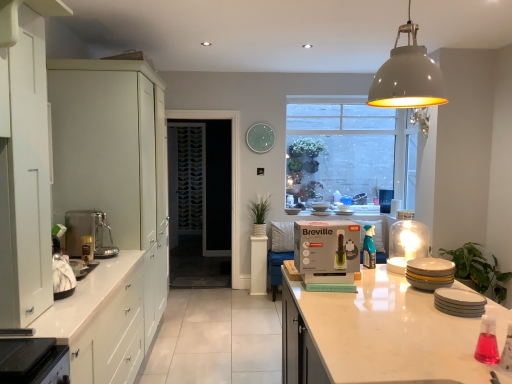
Question: From the image's perspective, would you say white glossy countertop at lower center, which is counted as the second countertop, starting from the front, is positioned over white matte cabinet at left, acting as the second cabinetry starting from the back?

Choices:
 (A) yes
 (B) no

Answer: (B)

Question: Could you tell me if white glossy countertop at lower center, which is counted as the second countertop, starting from the front, is turned towards white matte cabinet at left, acting as the second cabinetry starting from the back?

Choices:
 (A) yes
 (B) no

Answer: (B)

Question: Is white matte cabinet at left, acting as the second cabinetry starting from the back, located within white glossy countertop at lower center, which is counted as the second countertop, starting from the front?

Choices:
 (A) no
 (B) yes

Answer: (A)

Question: Does white glossy countertop at lower center, acting as the first countertop starting from the back, have a greater height compared to white matte cabinet at left, acting as the second cabinetry starting from the back?

Choices:
 (A) yes
 (B) no

Answer: (B)

Question: Can you confirm if white glossy countertop at lower center, positioned as the 1th countertop in right-to-left order, is positioned to the right of white matte cabinet at left, placed as the 1th cabinetry when sorted from front to back?

Choices:
 (A) yes
 (B) no

Answer: (A)

Question: From a real-world perspective, does white glossy countertop at lower center, positioned as the 1th countertop in right-to-left order, sit lower than white matte cabinet at left, acting as the second cabinetry starting from the back?

Choices:
 (A) yes
 (B) no

Answer: (A)

Question: Does matte ceramic plates at right, marked as the second appliance in a back-to-front arrangement, have a lesser width compared to matte white cabinets at left, which appears as the second cabinetry when viewed from the front?

Choices:
 (A) no
 (B) yes

Answer: (B)

Question: Is matte white cabinets at left, the first cabinetry positioned from the back, located within matte ceramic plates at right, marked as the second appliance in a back-to-front arrangement?

Choices:
 (A) no
 (B) yes

Answer: (A)

Question: Are matte ceramic plates at right, arranged as the second appliance when viewed from the front, and matte white cabinets at left, which appears as the second cabinetry when viewed from the front, located far from each other?

Choices:
 (A) yes
 (B) no

Answer: (A)

Question: Is matte ceramic plates at right, marked as the second appliance in a back-to-front arrangement, to the left of matte white cabinets at left, the first cabinetry positioned from the back, from the viewer's perspective?

Choices:
 (A) yes
 (B) no

Answer: (B)

Question: From the image's perspective, is matte ceramic plates at right, marked as the second appliance in a back-to-front arrangement, on matte white cabinets at left, the first cabinetry positioned from the back?

Choices:
 (A) yes
 (B) no

Answer: (B)

Question: Can we say matte ceramic plates at right, marked as the second appliance in a back-to-front arrangement, lies outside matte white cabinets at left, the first cabinetry positioned from the back?

Choices:
 (A) yes
 (B) no

Answer: (A)

Question: Is matte gray dome at upper center located outside patterned glass screen door at center?

Choices:
 (A) no
 (B) yes

Answer: (B)